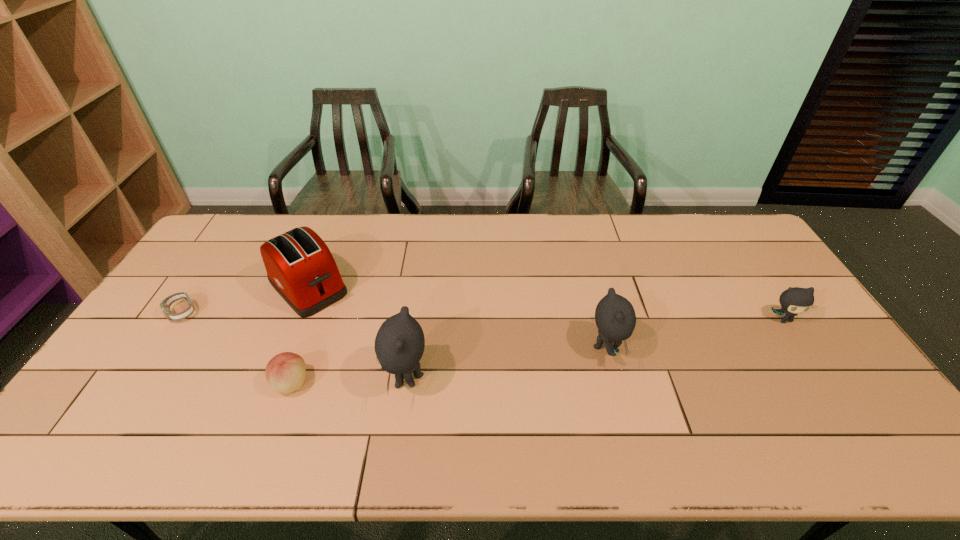
You are a GUI agent. You are given a task and a screenshot of the screen. Output one action in this format:
    pyautogui.click(x=<x>, y=<y>)
    Task: Click on the object that is positioned at the right edge
    Image resolution: width=960 pixels, height=540 pixels.
    Given the screenshot: What is the action you would take?
    pyautogui.click(x=796, y=300)

Find the location of a particular element. Image resolution: width=960 pixels, height=540 pixels. vacant region at the far edge is located at coordinates (348, 227).

At what (x,y) coordinates should I click in order to perform the action: click on vacant space at the near edge of the desktop. Please return your answer as a coordinate pair (x, y). Image resolution: width=960 pixels, height=540 pixels. Looking at the image, I should click on (221, 418).

I want to click on free space at the left edge of the desktop, so click(159, 319).

What are the coordinates of `vacant area at the right edge` in the screenshot? It's located at (824, 361).

This screenshot has height=540, width=960. I want to click on vacant region at the far right corner of the desktop, so click(x=711, y=227).

Locate an element on the screen. The height and width of the screenshot is (540, 960). blank region between the peach and the rightmost object is located at coordinates (538, 351).

This screenshot has height=540, width=960. Find the location of `empty location between the fifth tallest object and the leftmost kitten`. empty location between the fifth tallest object and the leftmost kitten is located at coordinates (348, 381).

Where is `free space between the toaster and the fifth object from left to right`? Image resolution: width=960 pixels, height=540 pixels. free space between the toaster and the fifth object from left to right is located at coordinates (457, 317).

The image size is (960, 540). I want to click on free point between the toaster and the second shortest object, so click(300, 335).